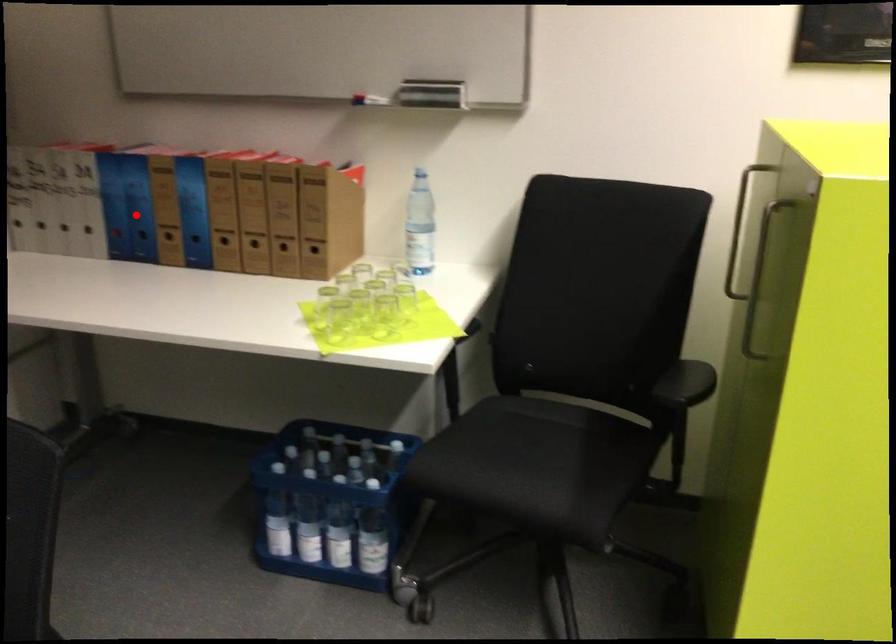
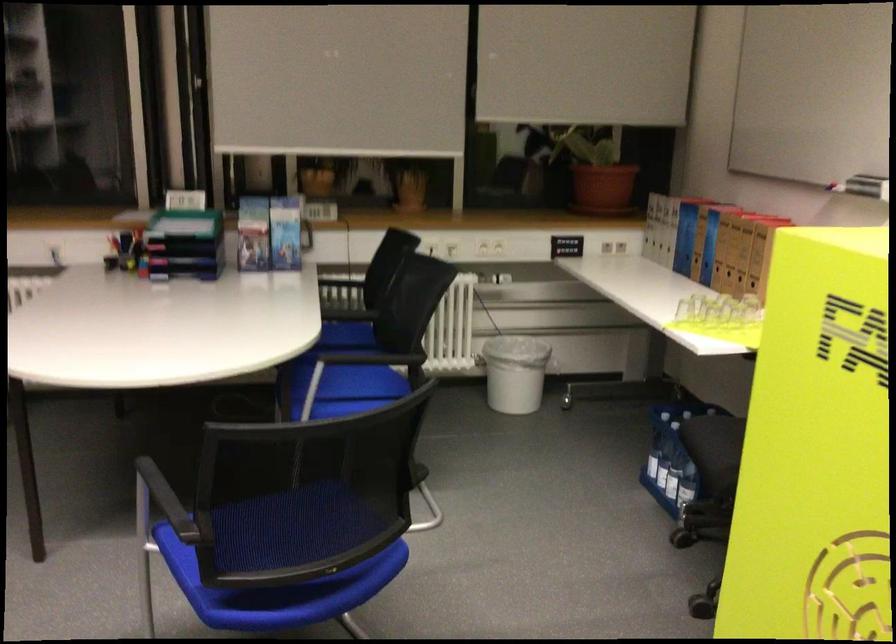
The point at the highlighted location is marked in the first image. Where is the corresponding point in the second image?

(685, 238)